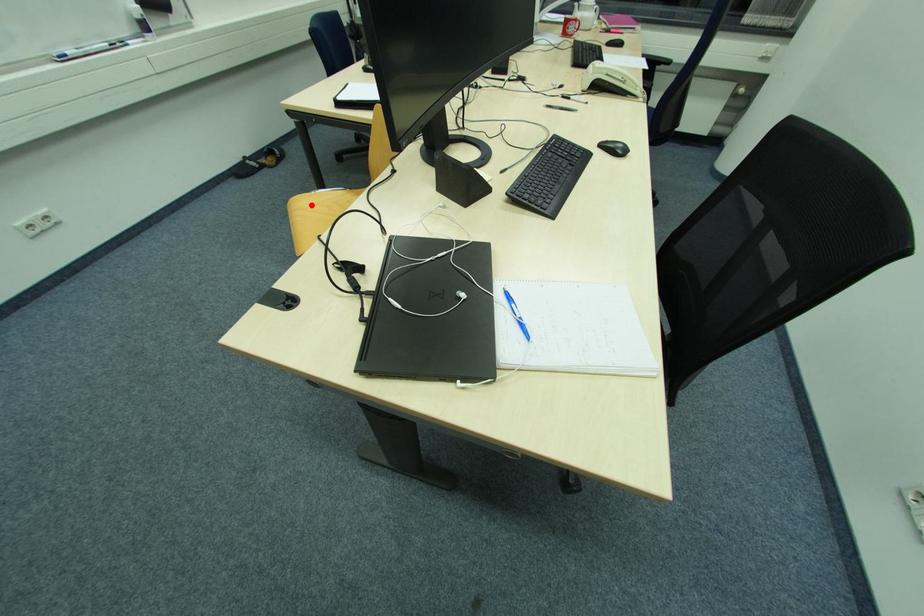
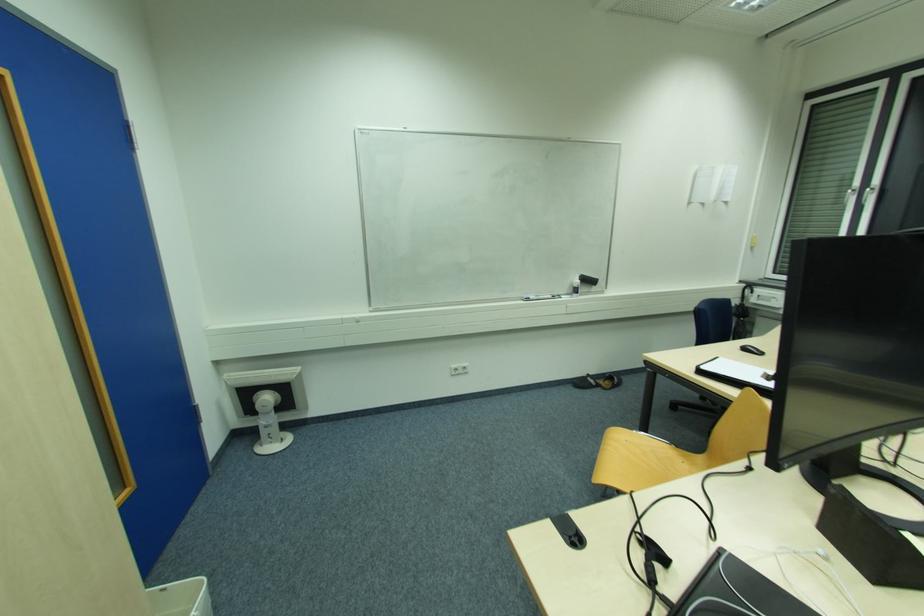
Question: I am providing you with two images of the same scene from different viewpoints. Image1 has a red point marked. In image2, the corresponding 3D location appears at what relative position? Reply with the corresponding letter.

Choices:
 (A) Closer
 (B) Farther

Answer: (A)